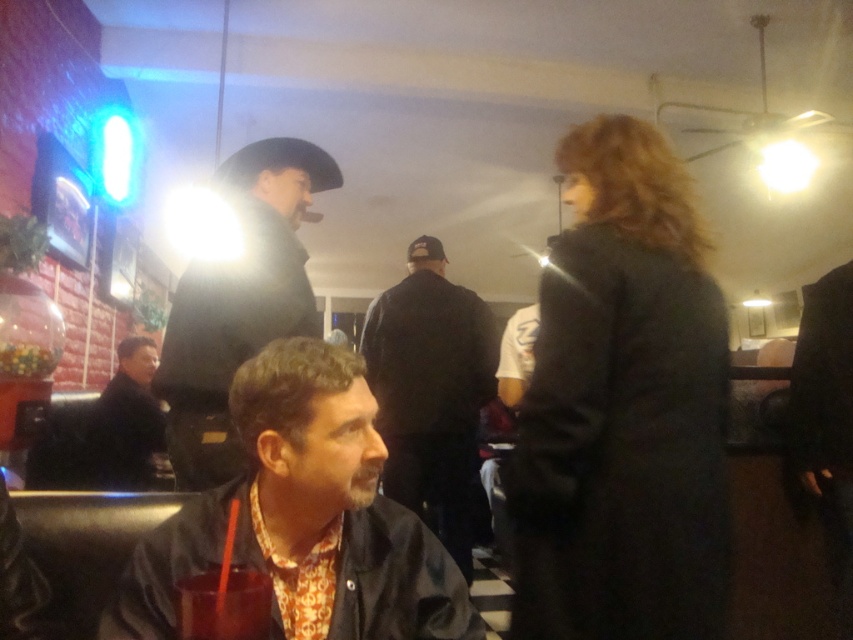
Which is in front, point (263, 330) or point (142, 435)?

Positioned in front is point (263, 330).

Which is behind, point (227, 163) or point (148, 422)?

Point (148, 422)

Locate an element on the screen. black leather cowboy hat at upper left is located at coordinates (239, 301).

Is point (386, 376) positioned before point (94, 472)?

Yes, it is in front of point (94, 472).

Which is in front, point (462, 397) or point (96, 451)?

Point (462, 397)

This screenshot has width=853, height=640. What are the coordinates of `dark blue jacket at center` in the screenshot? It's located at (431, 392).

Between floral shirt at center and black leather cowboy hat at upper left, which one is positioned higher?

black leather cowboy hat at upper left is higher up.

Between floral shirt at center and black leather cowboy hat at upper left, which one appears on the left side from the viewer's perspective?

black leather cowboy hat at upper left

Is point (229, 397) less distant than point (178, 458)?

That is True.

Where is `floral shirt at center`? This screenshot has height=640, width=853. floral shirt at center is located at coordinates (305, 516).